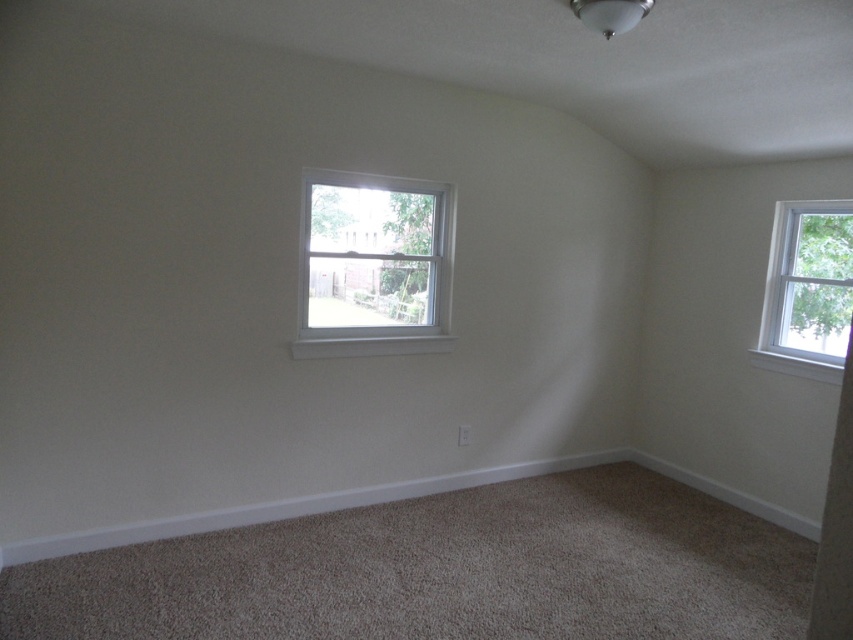
You are an interior designer planning to install a new curtain rod above the white painted wood window at center and the white wood window at upper right. Since you want the rods to be proportional to the window sizes, which window requires a longer curtain rod?

The white wood window at upper right requires a longer curtain rod because it has a greater height than the white painted wood window at center.

You are standing in the room and want to open a window to let in some fresh air. Which window, the white painted wood window at center or the white wood window at upper right, is positioned higher up and thus might provide better ventilation?

The white painted wood window at center is located above the white wood window at upper right, so it is positioned higher up and might provide better ventilation.

You are standing in the room and want to open the window to let in some fresh air. Which window should you approach, the white painted wood window at center or the other window on the right? Please explain your reasoning based on their positions.

The white painted wood window at center is located at point (373, 264), so you should approach the white painted wood window at center because it is positioned closer to the center of the room, making it more accessible from where you are standing.